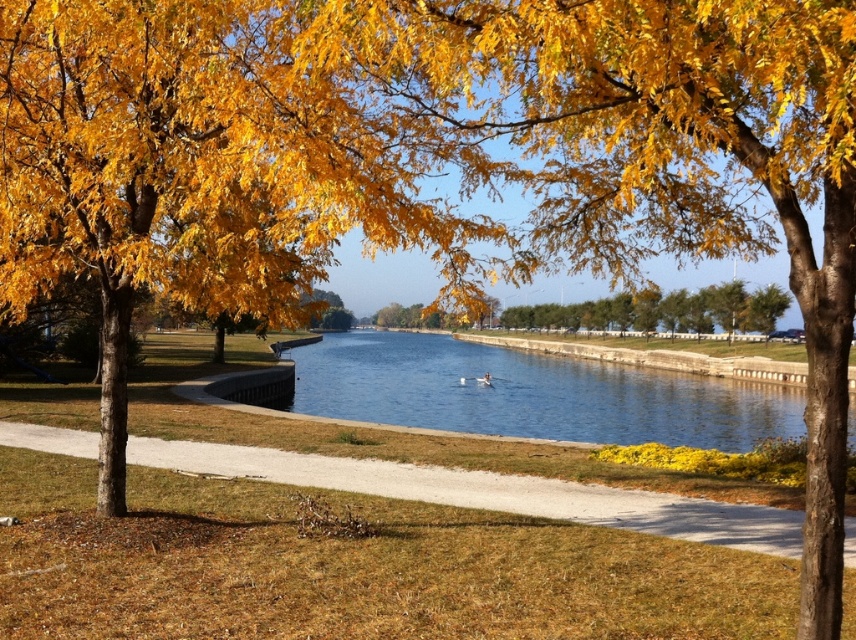
Is the position of gravel path at center more distant than that of yellow leafy tree at center?

Yes, gravel path at center is further from the viewer.

Does gravel path at center appear over yellow leafy tree at center?

No, gravel path at center is not above yellow leafy tree at center.

Which is behind, point (544, 481) or point (685, 301)?

Point (685, 301)

Where is `gravel path at center`? gravel path at center is located at coordinates (490, 492).

Is blue smooth water at center wider than yellow leafy tree at center?

Correct, the width of blue smooth water at center exceeds that of yellow leafy tree at center.

Locate an element on the screen. The width and height of the screenshot is (856, 640). blue smooth water at center is located at coordinates (531, 394).

Is blue smooth water at center in front of gravel path at center?

No.

Does blue smooth water at center appear over gravel path at center?

Indeed, blue smooth water at center is positioned over gravel path at center.

This screenshot has height=640, width=856. Identify the location of blue smooth water at center. (531, 394).

Where is `blue smooth water at center`? The image size is (856, 640). blue smooth water at center is located at coordinates (531, 394).